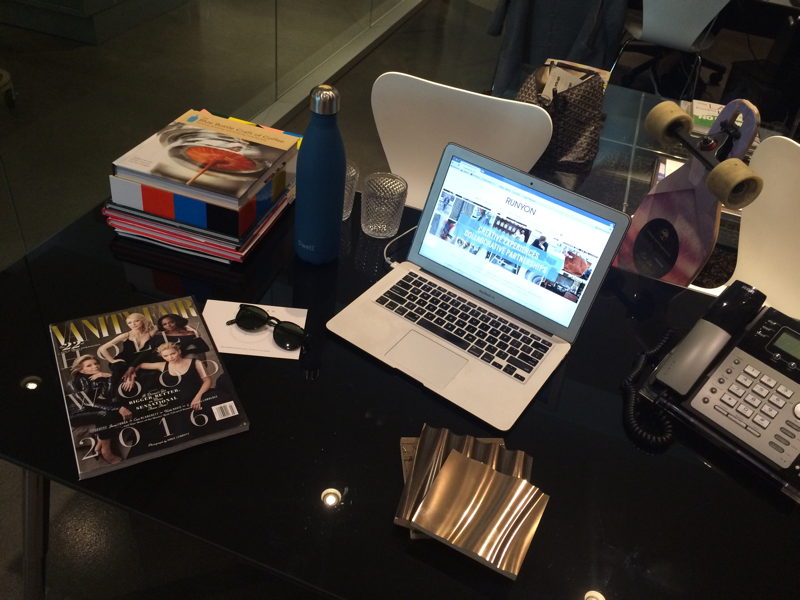
The height and width of the screenshot is (600, 800). Find the location of `glass cup`. glass cup is located at coordinates (386, 217).